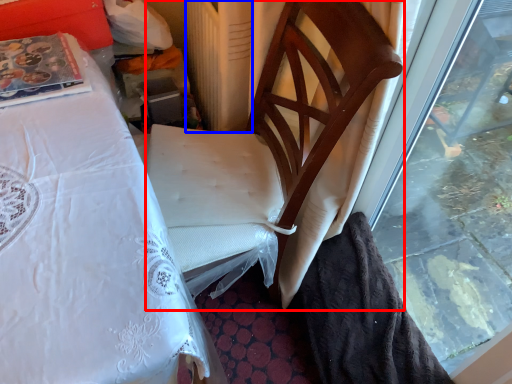
Question: Among these objects, which one is nearest to the camera, chair (highlighted by a red box) or radiator (highlighted by a blue box)?

Choices:
 (A) chair
 (B) radiator

Answer: (A)